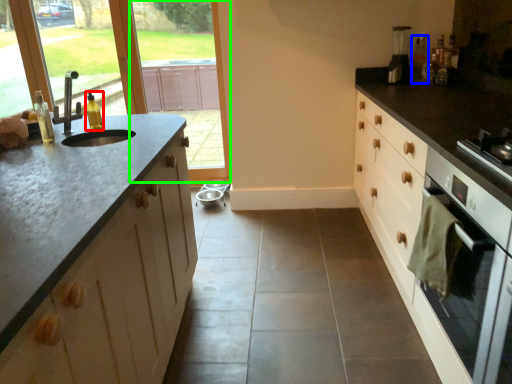
Question: Which is farther away from bottle (highlighted by a red box)? bottle (highlighted by a blue box) or window screen (highlighted by a green box)?

Choices:
 (A) bottle
 (B) window screen

Answer: (B)